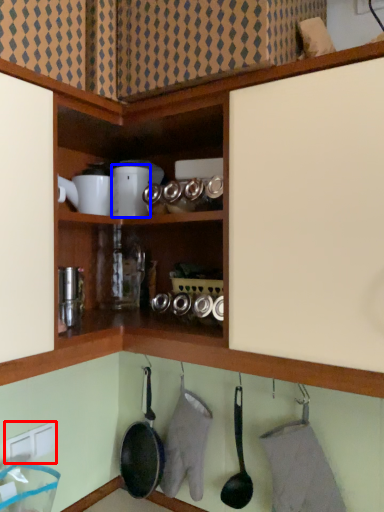
Question: Which object is closer to the camera taking this photo, electric outlet (highlighted by a red box) or appliance (highlighted by a blue box)?

Choices:
 (A) electric outlet
 (B) appliance

Answer: (A)